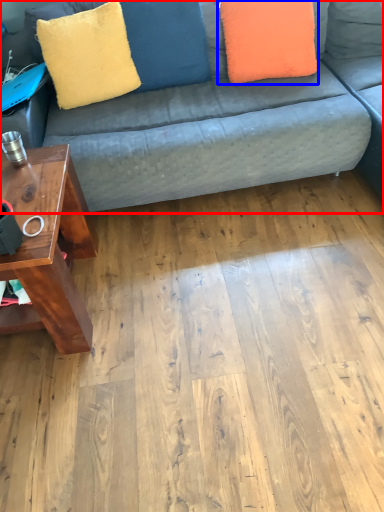
Question: Which point is further to the camera, studio couch (highlighted by a red box) or pillow (highlighted by a blue box)?

Choices:
 (A) studio couch
 (B) pillow

Answer: (B)